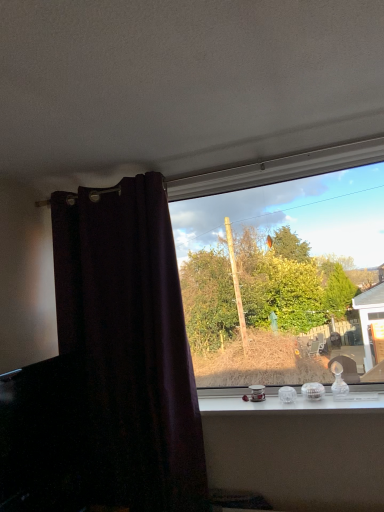
Question: Is dark purple velvet curtain at left oriented towards transparent glass window at center?

Choices:
 (A) no
 (B) yes

Answer: (A)

Question: Considering the relative positions of dark purple velvet curtain at left and transparent glass window at center in the image provided, is dark purple velvet curtain at left behind transparent glass window at center?

Choices:
 (A) no
 (B) yes

Answer: (A)

Question: From a real-world perspective, is dark purple velvet curtain at left physically below transparent glass window at center?

Choices:
 (A) yes
 (B) no

Answer: (A)

Question: Does dark purple velvet curtain at left have a greater height compared to transparent glass window at center?

Choices:
 (A) no
 (B) yes

Answer: (B)

Question: Is dark purple velvet curtain at left at the left side of transparent glass window at center?

Choices:
 (A) no
 (B) yes

Answer: (B)

Question: From the image's perspective, is dark purple velvet curtain at left above or below clear glass ornaments at center?

Choices:
 (A) below
 (B) above

Answer: (B)

Question: From a real-world perspective, is dark purple velvet curtain at left positioned above or below clear glass ornaments at center?

Choices:
 (A) above
 (B) below

Answer: (A)

Question: Considering the positions of point (145, 426) and point (304, 403), is point (145, 426) closer or farther from the camera than point (304, 403)?

Choices:
 (A) farther
 (B) closer

Answer: (A)

Question: Would you say dark purple velvet curtain at left is inside or outside clear glass ornaments at center?

Choices:
 (A) inside
 (B) outside

Answer: (B)

Question: From a real-world perspective, is transparent glass window at center above or below clear glass ornaments at center?

Choices:
 (A) above
 (B) below

Answer: (A)

Question: Based on their positions, is transparent glass window at center located to the left or right of clear glass ornaments at center?

Choices:
 (A) right
 (B) left

Answer: (A)

Question: From the image's perspective, relative to clear glass ornaments at center, is transparent glass window at center above or below?

Choices:
 (A) below
 (B) above

Answer: (B)

Question: Looking at their shapes, would you say transparent glass window at center is wider or thinner than clear glass ornaments at center?

Choices:
 (A) thin
 (B) wide

Answer: (A)

Question: Is clear glass ornaments at center to the left or to the right of transparent glass window at center in the image?

Choices:
 (A) right
 (B) left

Answer: (B)

Question: Does point (221, 393) appear closer or farther from the camera than point (327, 374)?

Choices:
 (A) closer
 (B) farther

Answer: (B)